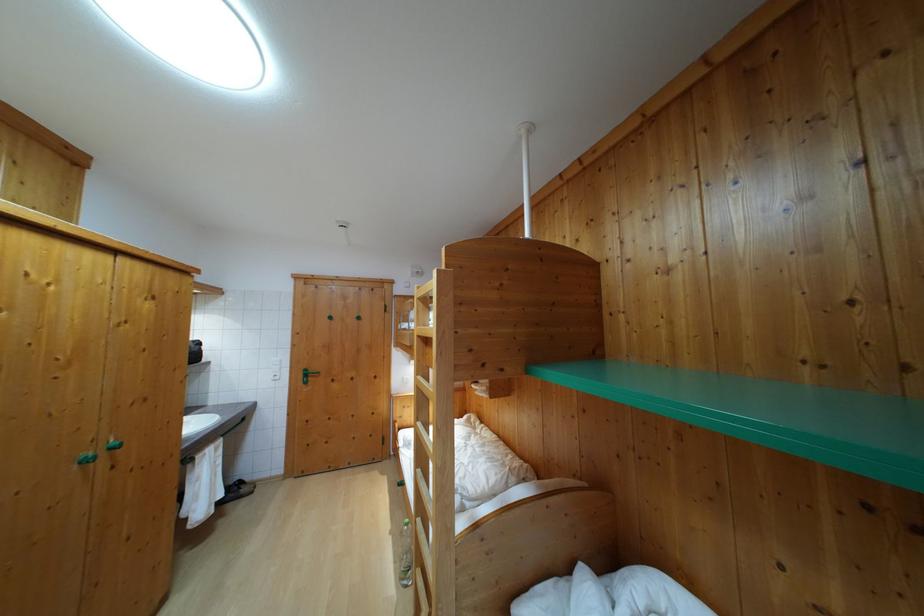
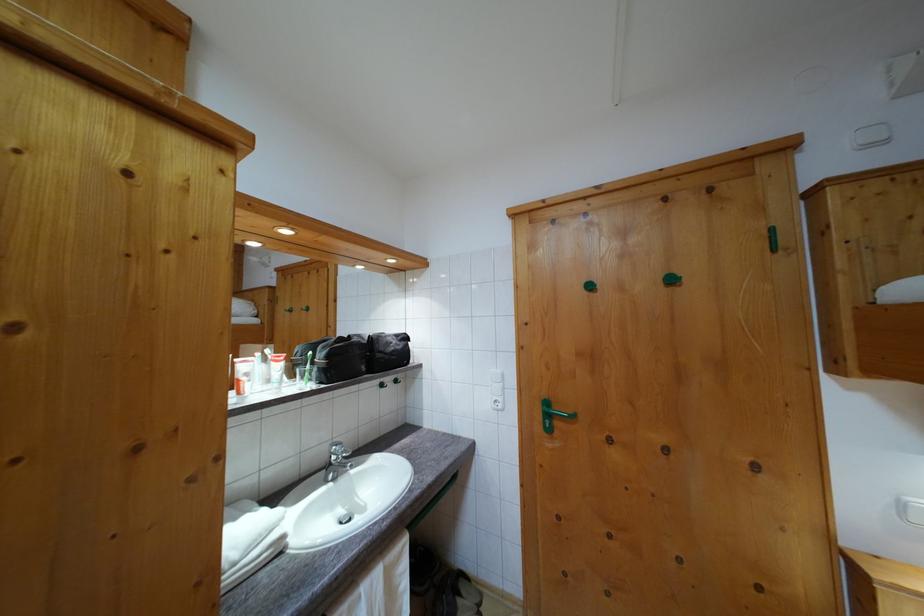
In the second image, find the point that corresponds to pixel 198 349 in the first image.

(400, 342)